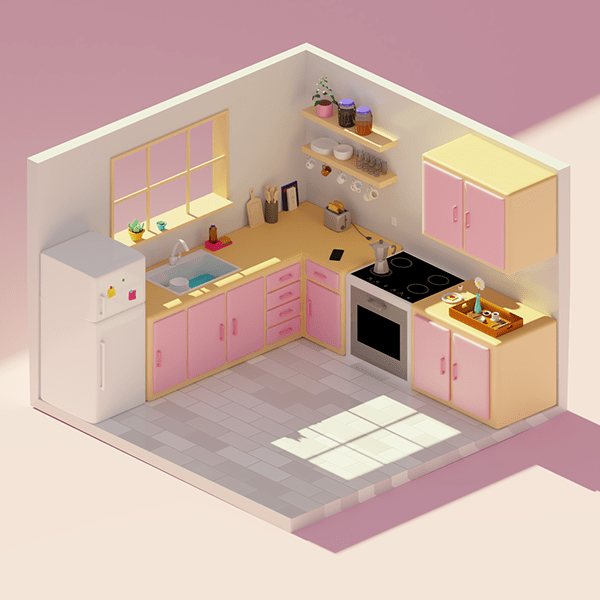
This screenshot has width=600, height=600. I want to click on window, so click(168, 151).